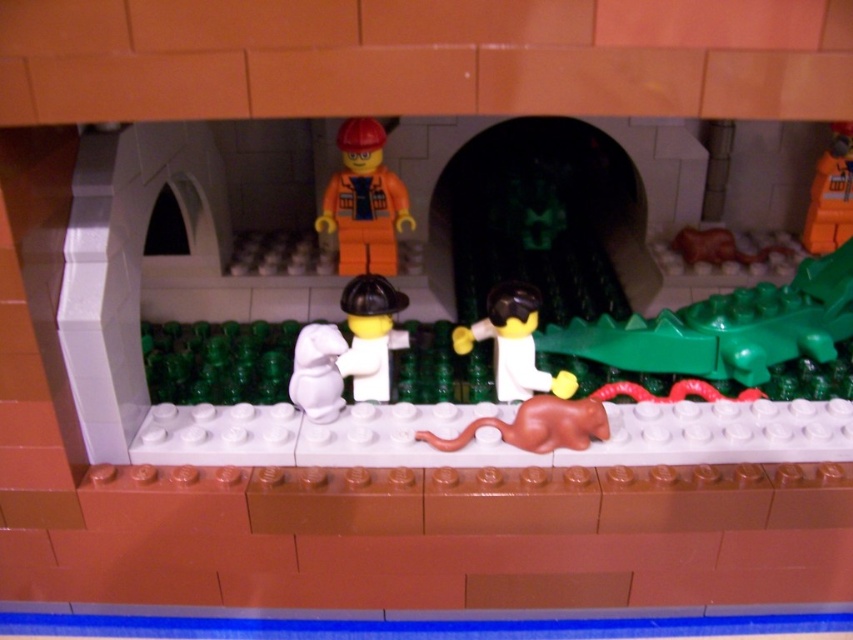
Question: Among these objects, which one is farthest from the camera?

Choices:
 (A) orange matte construction worker at center
 (B) white matte mouse at center

Answer: (A)

Question: Is orange plastic toy at center to the right of white matte mouse at center from the viewer's perspective?

Choices:
 (A) yes
 (B) no

Answer: (A)

Question: Does orange matte construction worker at center appear on the right side of orange plastic toy at center?

Choices:
 (A) yes
 (B) no

Answer: (B)

Question: Which of these objects is positioned farthest from the orange matte construction worker at center?

Choices:
 (A) white matte minifigure at center
 (B) brown rubber snake at right

Answer: (B)

Question: Can you confirm if white matte figure at center is smaller than white matte mouse at center?

Choices:
 (A) no
 (B) yes

Answer: (A)

Question: Which object is farther from the camera taking this photo?

Choices:
 (A) white matte mouse at center
 (B) orange plastic toy at center
 (C) brown rubber snake at right
 (D) orange matte construction worker at center

Answer: (C)